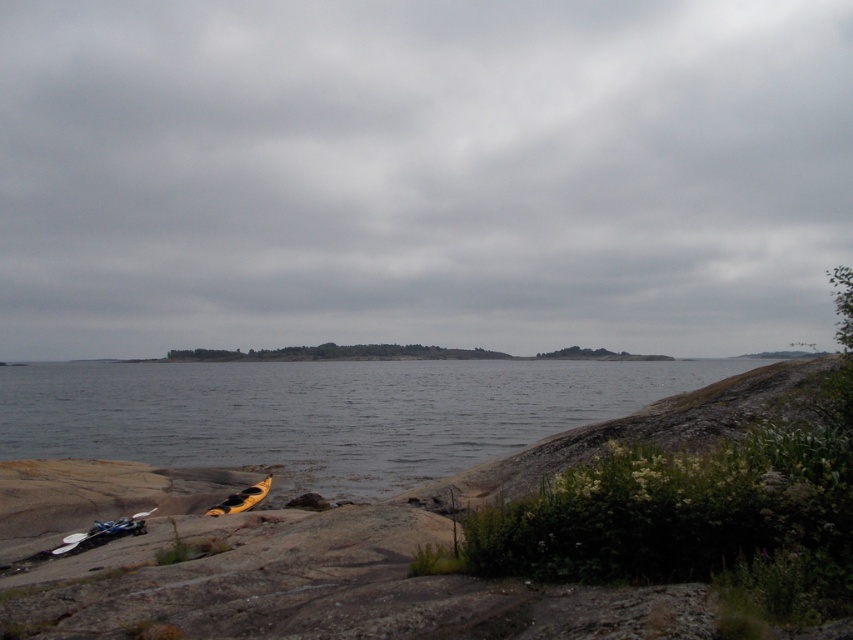
The image size is (853, 640). Identify the location of blue plastic kayak at lower left. (102, 532).

Does blue plastic kayak at lower left appear under yellow matte kayak at lower left?

No.

Identify the location of blue plastic kayak at lower left. (102, 532).

Where is `blue plastic kayak at lower left`? Image resolution: width=853 pixels, height=640 pixels. blue plastic kayak at lower left is located at coordinates (102, 532).

Between clear water at lower left and blue plastic kayak at lower left, which one appears on the right side from the viewer's perspective?

blue plastic kayak at lower left

Can you confirm if clear water at lower left is thinner than blue plastic kayak at lower left?

No, clear water at lower left is not thinner than blue plastic kayak at lower left.

Who is more forward, (155, 428) or (137, 531)?

Positioned in front is point (137, 531).

At what (x,y) coordinates should I click in order to perform the action: click on clear water at lower left. Please return your answer as a coordinate pair (x, y). Image resolution: width=853 pixels, height=640 pixels. Looking at the image, I should click on (326, 412).

Is point (231, 451) positioned before point (248, 497)?

No, (231, 451) is further to viewer.

At what (x,y) coordinates should I click in order to perform the action: click on clear water at lower left. Please return your answer as a coordinate pair (x, y). The width and height of the screenshot is (853, 640). Looking at the image, I should click on (326, 412).

I want to click on clear water at lower left, so click(326, 412).